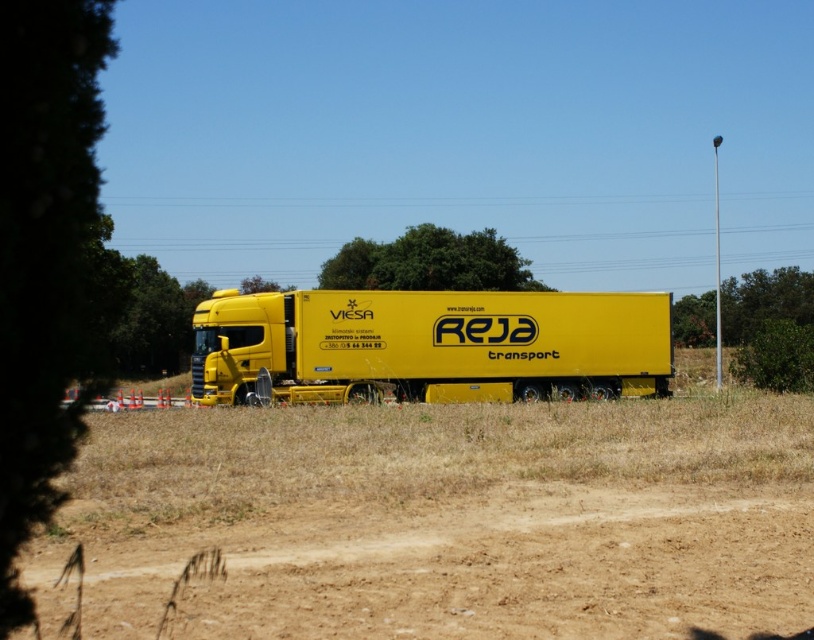
You are a photographer planning to take a picture of the truck parked on the side of the road. You want to ensure both the green leafy tree at center and the green leafy tree at right are visible in the frame. Based on their positions, which tree is closer to the truck?

The green leafy tree at center is closer to the truck because it is positioned to the left of the green leafy tree at right, which places it nearer to the truck compared to the one on the right.

You are a delivery driver who needs to navigate between two points marked on the truck image. The first point is at coordinates point (x=333, y=268) and the second is at point (x=696, y=324). Which point should you approach first if you want to follow the correct path from the truck?

Point (x=333, y=268) is in front of point (x=696, y=324), so you should approach point (x=333, y=268) first as it is closer to the truck.